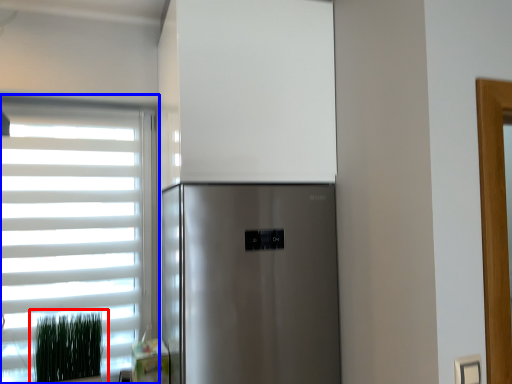
Question: Which object appears farthest to the camera in this image, plant (highlighted by a red box) or window (highlighted by a blue box)?

Choices:
 (A) plant
 (B) window

Answer: (B)